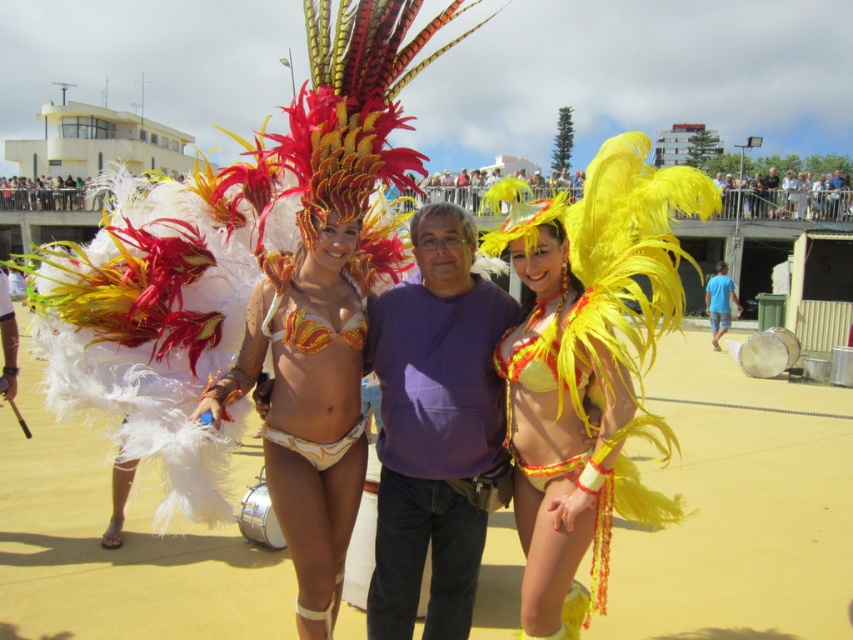
Question: Is shiny sequined bikini top at center positioned at the back of yellow feathered bikini at center?

Choices:
 (A) yes
 (B) no

Answer: (A)

Question: Can you confirm if shiny sequined bikini top at center is wider than yellow feathered bikini at center?

Choices:
 (A) yes
 (B) no

Answer: (A)

Question: Is shiny sequined bikini top at center closer to camera compared to yellow feathered bikini at center?

Choices:
 (A) yes
 (B) no

Answer: (B)

Question: Which of the following is the farthest from the observer?

Choices:
 (A) (299, 301)
 (B) (537, 506)

Answer: (A)

Question: Which point appears closest to the camera in this image?

Choices:
 (A) (254, 307)
 (B) (585, 384)

Answer: (B)